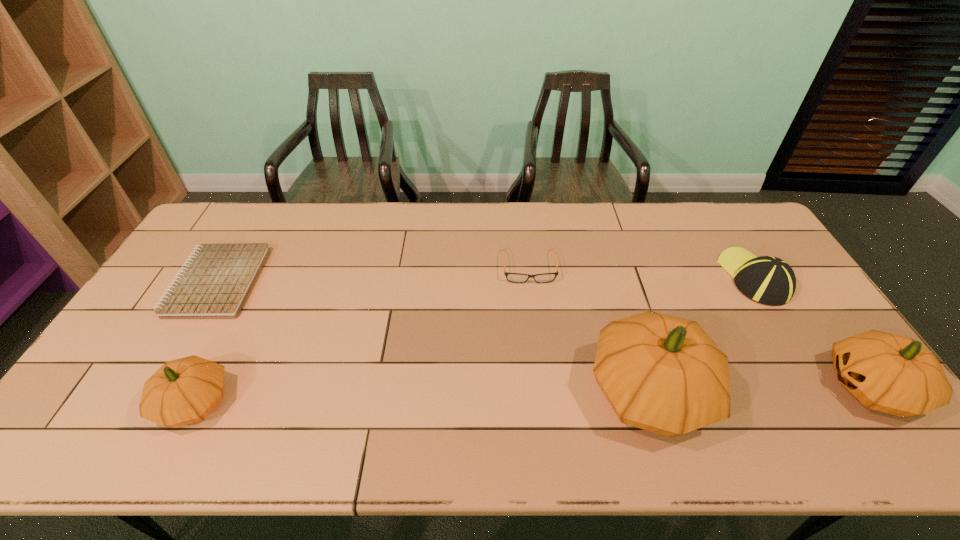
Identify the location of spot to insert another gourd for uniform distribution. (424, 397).